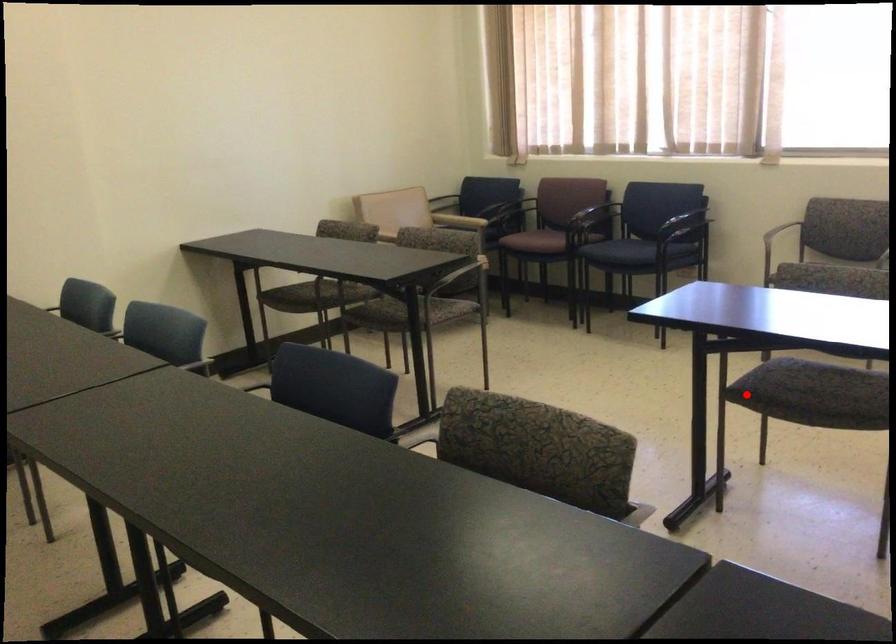
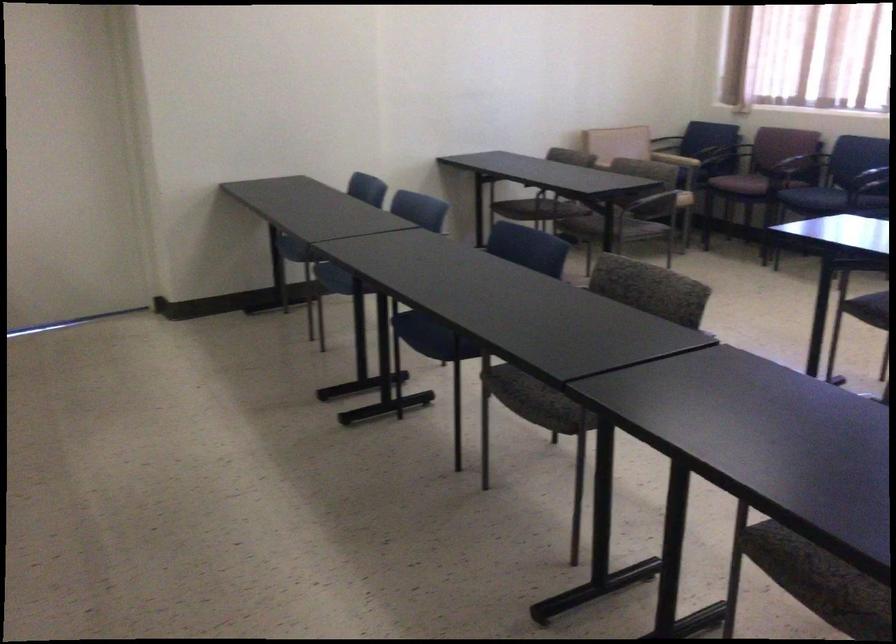
Locate, in the second image, the point that corresponds to the highlighted location in the first image.

(868, 308)